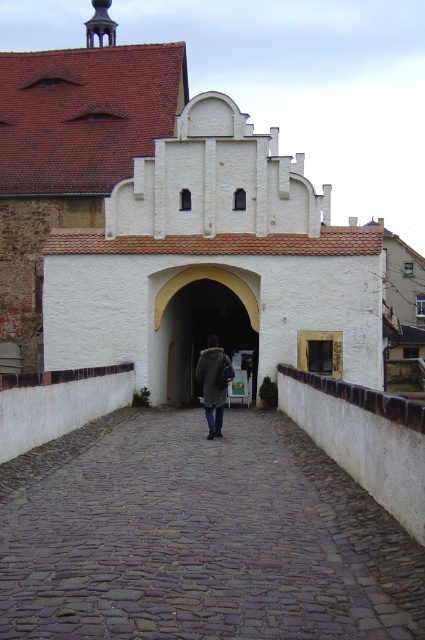
You are a tourist standing at the entrance of the historic stone structure. You see the cobblestone path at center and the smooth white archway at center. Which one is positioned higher from the ground?

The smooth white archway at center is positioned higher from the ground than the cobblestone path at center because the cobblestone path at center is located below it.

You are a visitor approaching the historic stone structure and notice both the smooth white archway at center and the dark gray wool coat at center. Which object is bigger in size?

The smooth white archway at center is larger in size compared to the dark gray wool coat at center.